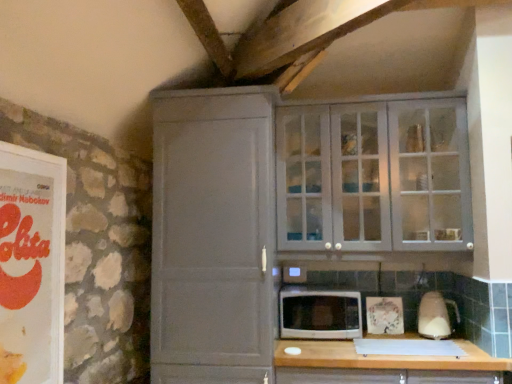
Question: Is white glossy blender at right in front of or behind matte orange book at left in the image?

Choices:
 (A) front
 (B) behind

Answer: (B)

Question: From the image's perspective, is white glossy blender at right located above or below matte orange book at left?

Choices:
 (A) above
 (B) below

Answer: (B)

Question: Which object is positioned closest to the matte gray cabinet at center, which ranks as the first cupboard in left-to-right order?

Choices:
 (A) matte gray cabinet at upper right, which appears as the 1th cupboard when viewed from the right
 (B) wooden at lower center
 (C) matte orange book at left
 (D) white glossy microwave at center
 (E) white glossy blender at right

Answer: (D)

Question: Considering the real-world distances, which object is farthest from the white glossy microwave at center?

Choices:
 (A) white glossy blender at right
 (B) matte gray cabinet at center, which is the 2th cupboard from right to left
 (C) matte orange book at left
 (D) matte gray cabinet at upper right, which appears as the 1th cupboard when viewed from the right
 (E) wooden at lower center

Answer: (C)